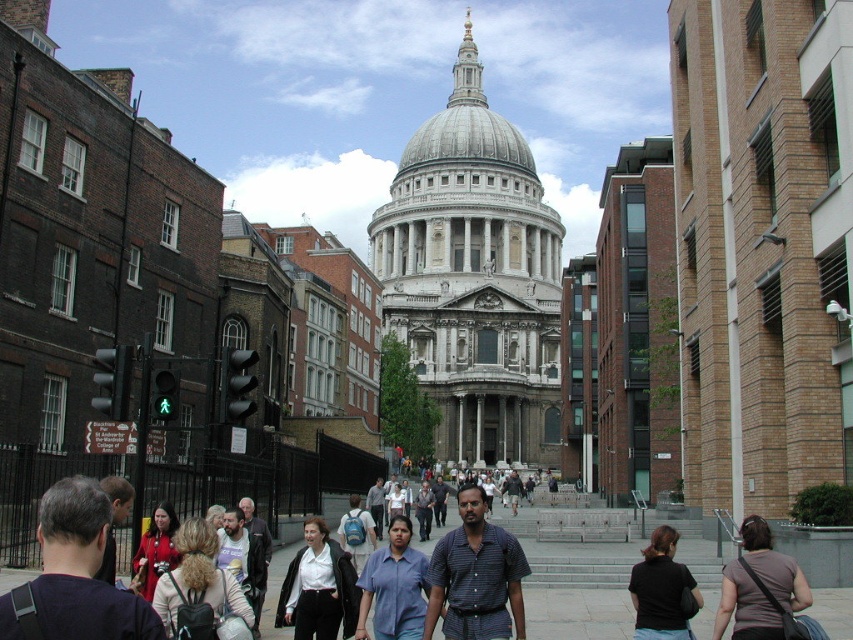
Question: Does dark gray shirt at lower right have a greater width compared to blue cotton shirt at center?

Choices:
 (A) no
 (B) yes

Answer: (A)

Question: Among these points, which one is farthest from the camera?

Choices:
 (A) (300, 582)
 (B) (676, 566)

Answer: (A)

Question: Is white marble cathedral at center to the right of blue cotton shirt at center from the viewer's perspective?

Choices:
 (A) yes
 (B) no

Answer: (A)

Question: Among these points, which one is nearest to the camera?

Choices:
 (A) (402, 602)
 (B) (722, 627)

Answer: (B)

Question: Which of the following is the closest to the observer?

Choices:
 (A) (755, 596)
 (B) (378, 572)
 (C) (483, 218)
 (D) (515, 540)

Answer: (A)

Question: Can you confirm if dark gray shirt at lower right is wider than blue cotton shirt at center?

Choices:
 (A) yes
 (B) no

Answer: (B)